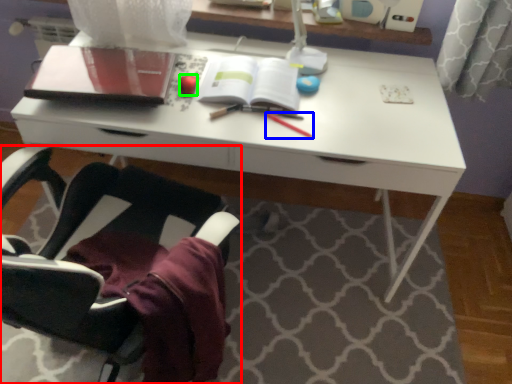
Question: Considering the real-world distances, which object is closest to chair (highlighted by a red box)? stationery (highlighted by a blue box) or stationery (highlighted by a green box).

Choices:
 (A) stationery
 (B) stationery

Answer: (B)